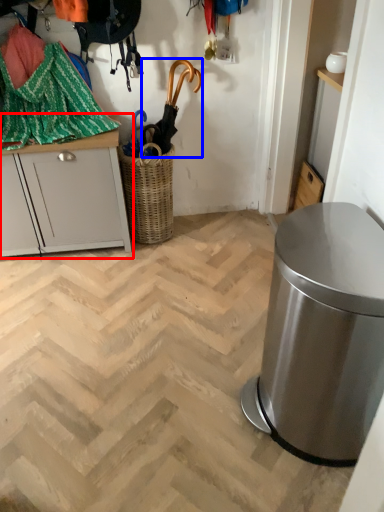
Question: Among these objects, which one is farthest to the camera, cabinetry (highlighted by a red box) or umbrella (highlighted by a blue box)?

Choices:
 (A) cabinetry
 (B) umbrella

Answer: (B)